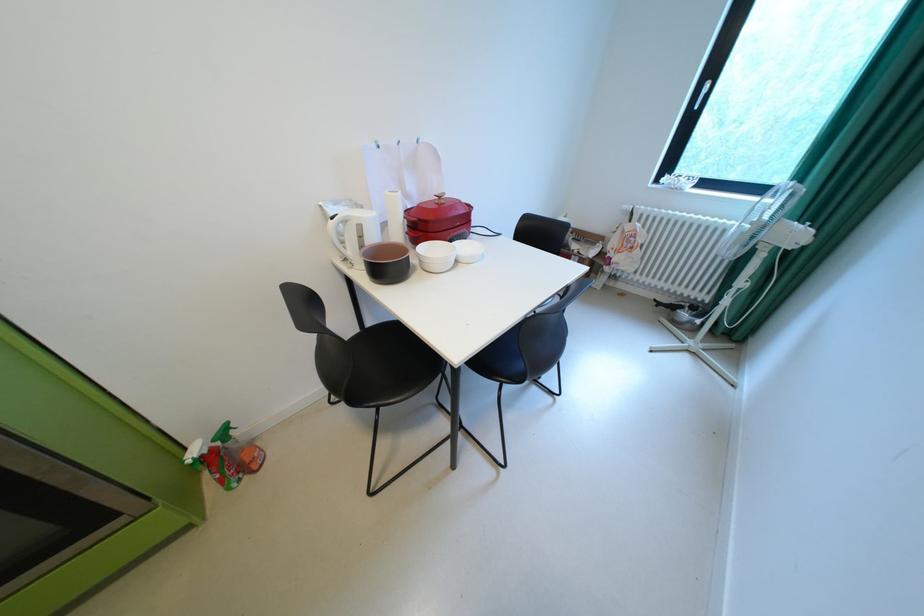
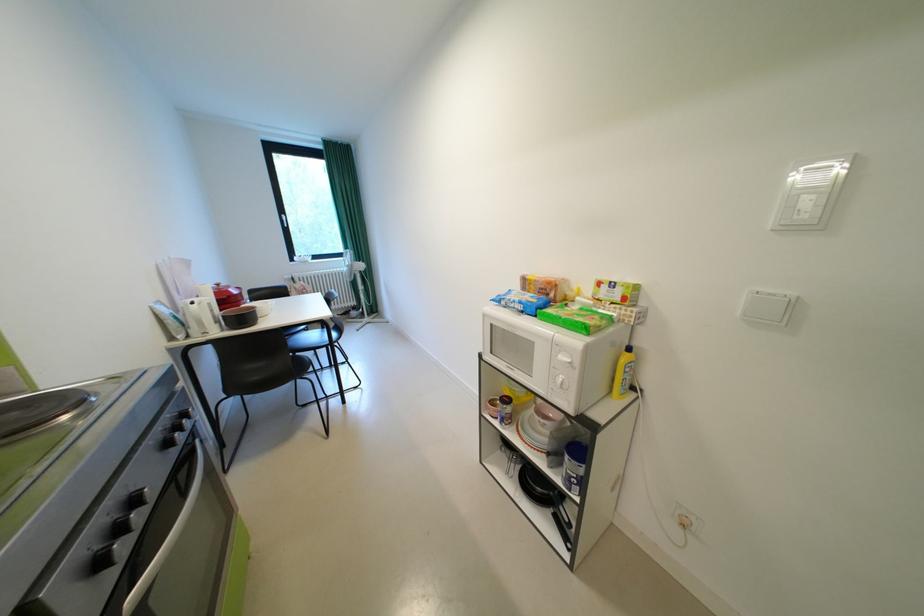
In the second image, find the point that corresponds to point (343, 219) in the first image.

(203, 304)